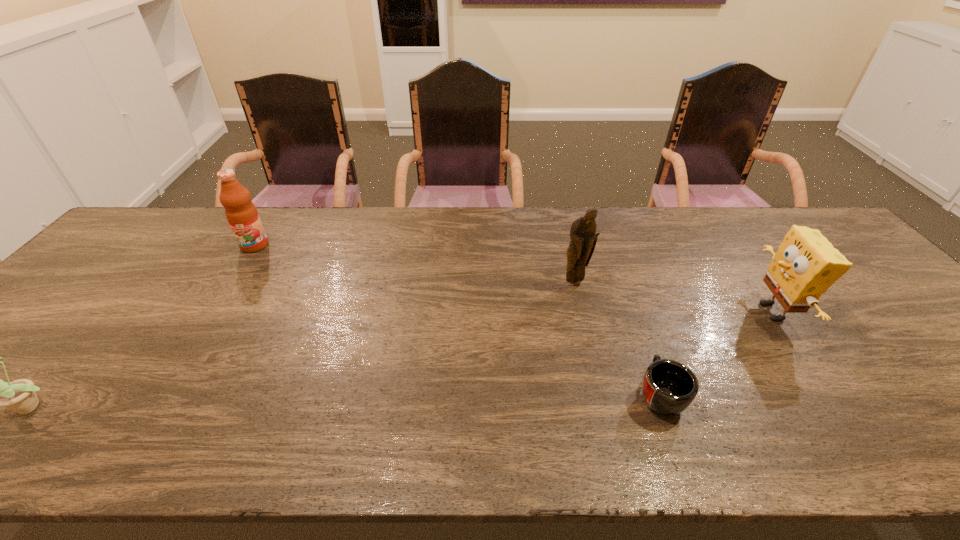
Where is `blank region between the figurine and the mug`? Image resolution: width=960 pixels, height=540 pixels. blank region between the figurine and the mug is located at coordinates (617, 339).

At what (x,y) coordinates should I click in order to perform the action: click on free space between the fruit juice and the figurine. Please return your answer as a coordinate pair (x, y). Looking at the image, I should click on (415, 265).

Locate an element on the screen. The image size is (960, 540). empty space between the mug and the sponge is located at coordinates (716, 353).

Where is `vacant region between the fourth object from right to left and the mug`? This screenshot has height=540, width=960. vacant region between the fourth object from right to left and the mug is located at coordinates (457, 320).

Identify the location of free space between the second object from right to left and the figurine. (617, 339).

Select which object is the second closest to the mug. Please provide its 2D coordinates. Your answer should be formatted as a tuple, i.e. [(x, y)], where the tuple contains the x and y coordinates of a point satisfying the conditions above.

[(582, 233)]

Where is `the closest object relative to the figurine`? Image resolution: width=960 pixels, height=540 pixels. the closest object relative to the figurine is located at coordinates (669, 387).